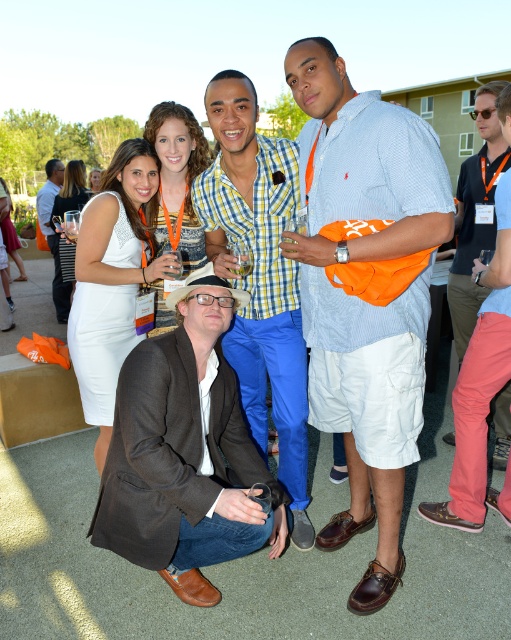
Question: Can you confirm if light blue woven shirt at center is bigger than matte white dress at center?

Choices:
 (A) yes
 (B) no

Answer: (A)

Question: Does light blue woven shirt at center have a larger size compared to checkered shirt at center?

Choices:
 (A) no
 (B) yes

Answer: (A)

Question: Among these objects, which one is farthest from the camera?

Choices:
 (A) brown leather jacket at lower center
 (B) orange cotton t-shirt at center

Answer: (B)

Question: Can you confirm if checkered shirt at center is bigger than white textured dress at center?

Choices:
 (A) no
 (B) yes

Answer: (B)

Question: Which point is closer to the camera?

Choices:
 (A) white textured dress at center
 (B) light blue woven shirt at center
 (C) matte black suit at lower left

Answer: (B)

Question: Which point is closer to the camera?

Choices:
 (A) white textured dress at center
 (B) light blue woven shirt at center
 (C) brown leather jacket at lower center
 (D) matte white dress at center

Answer: (B)